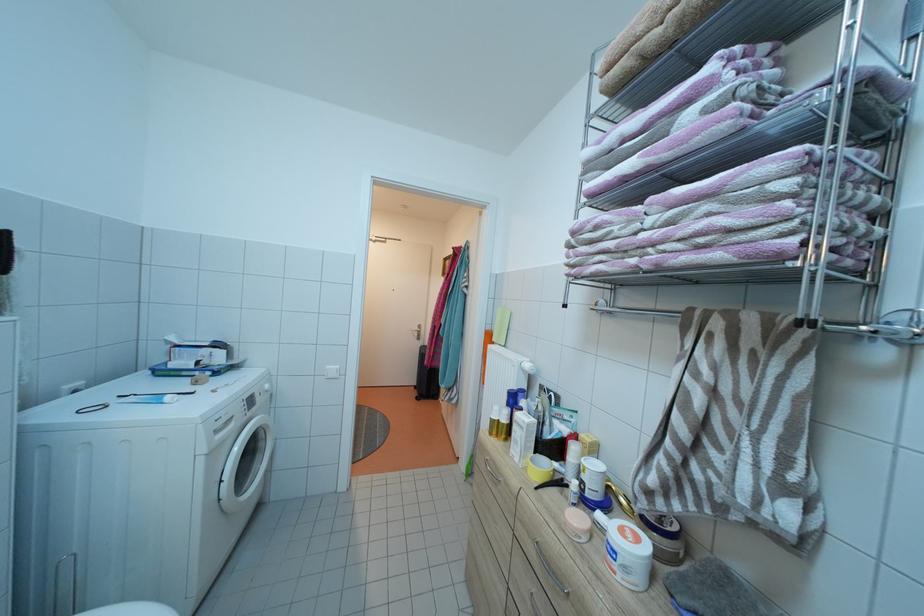
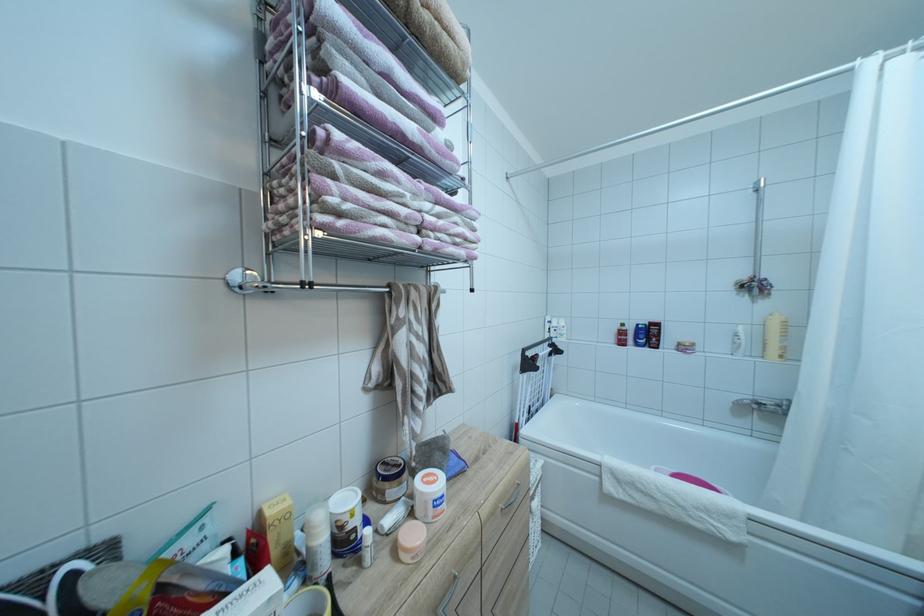
In the second image, find the point that corresponds to (x=633, y=543) in the first image.

(442, 487)